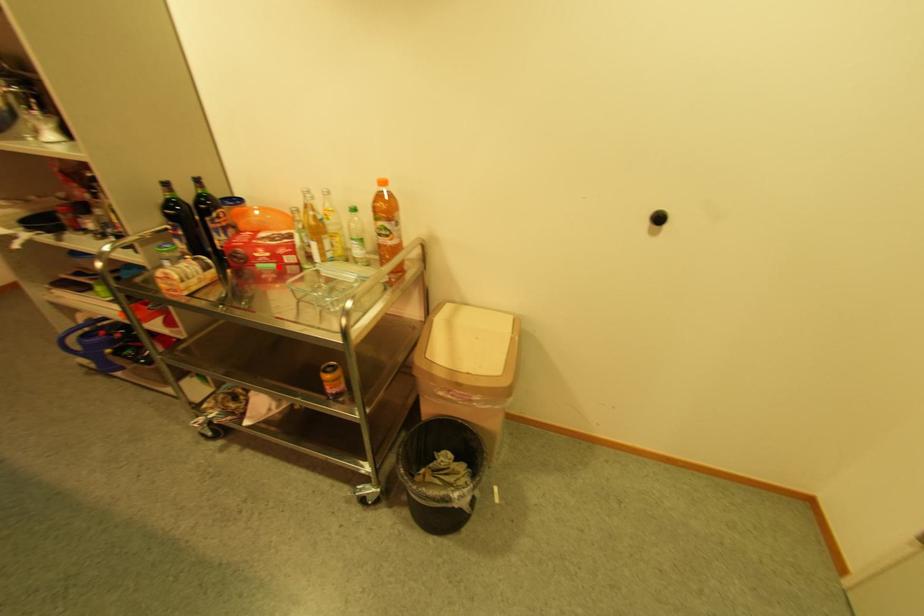
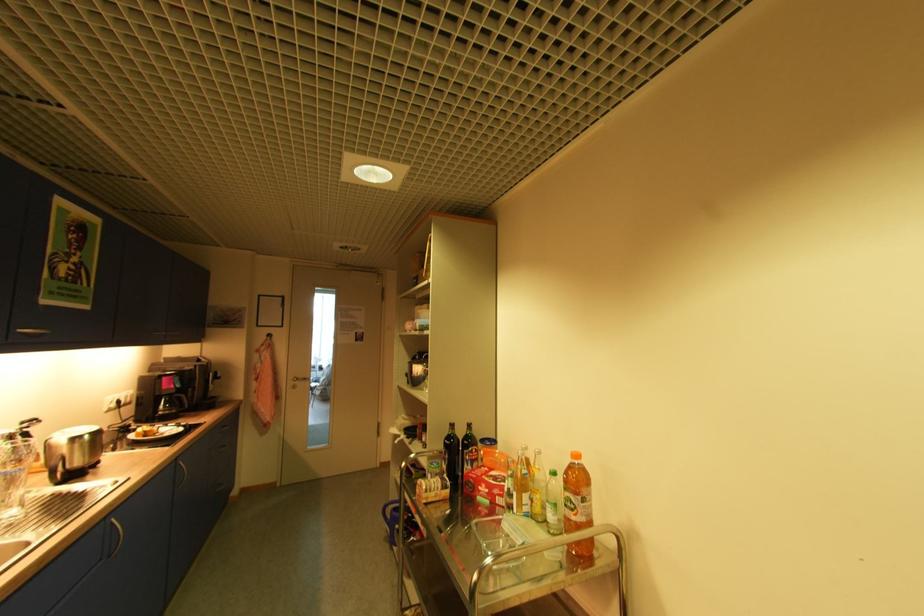
In the second image, find the point that corresponds to the highlighted location in the first image.

(492, 503)